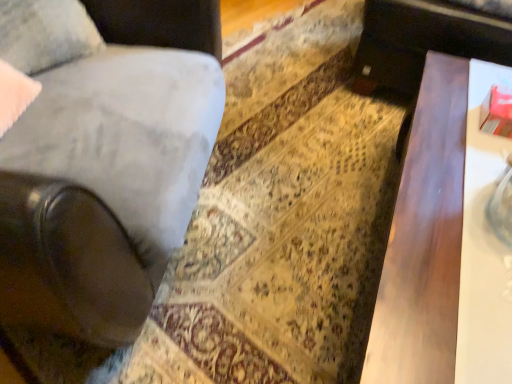
Question: From the image's perspective, is velvet gray pillow at upper left located above or below suede-like gray chair at left?

Choices:
 (A) below
 (B) above

Answer: (B)

Question: Is point (40, 26) positioned closer to the camera than point (163, 132)?

Choices:
 (A) farther
 (B) closer

Answer: (A)

Question: Based on their relative distances, which object is nearer to the dark wood table at right?

Choices:
 (A) velvet gray pillow at upper left
 (B) suede-like gray chair at left

Answer: (B)

Question: Which of these objects is positioned closest to the velvet gray pillow at upper left?

Choices:
 (A) suede-like gray chair at left
 (B) dark wood table at right

Answer: (A)